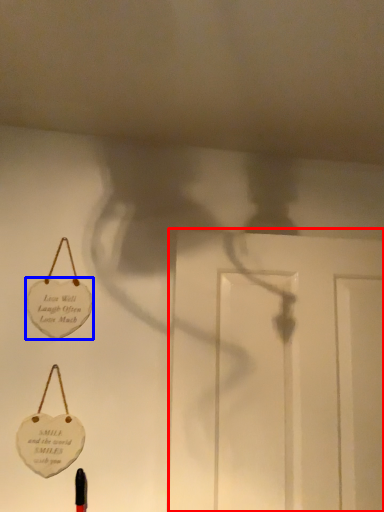
Question: Which object is closer to the camera taking this photo, door (highlighted by a red box) or badge (highlighted by a blue box)?

Choices:
 (A) door
 (B) badge

Answer: (A)